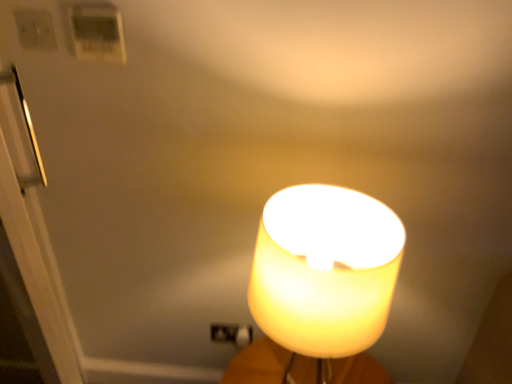
Question: In terms of width, does white glossy door at left look wider or thinner when compared to translucent yellow lampshade at center?

Choices:
 (A) wide
 (B) thin

Answer: (B)

Question: From a real-world perspective, is white glossy door at left physically located above or below translucent yellow lampshade at center?

Choices:
 (A) below
 (B) above

Answer: (A)

Question: Which is nearer to the white glossy door at left?

Choices:
 (A) translucent yellow lampshade at center
 (B) white plastic light switch at upper left, placed as the 2th light switch when sorted from right to left
 (C) white plastic thermostat at upper left, the second light switch in the left-to-right sequence

Answer: (C)

Question: Based on their relative distances, which object is farther from the white plastic light switch at upper left, placed as the 2th light switch when sorted from right to left?

Choices:
 (A) white glossy door at left
 (B) translucent yellow lampshade at center
 (C) white plastic thermostat at upper left, arranged as the first light switch when viewed from the right

Answer: (B)